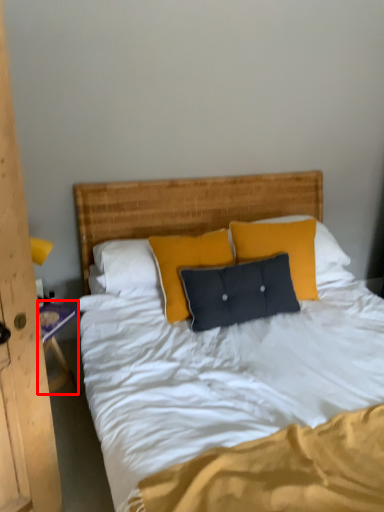
Question: From the image's perspective, where is nightstand (annotated by the red box) located relative to pillow?

Choices:
 (A) above
 (B) below

Answer: (B)